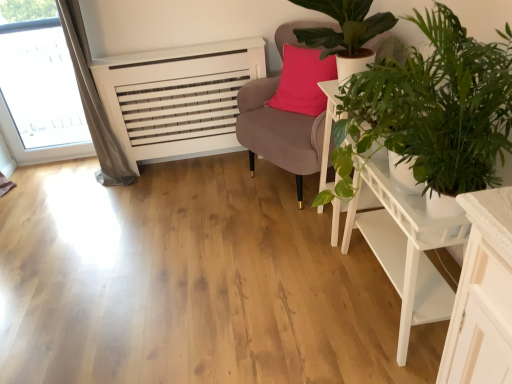
This screenshot has height=384, width=512. I want to click on free space to the left of white wooden table at lower right, so click(x=290, y=304).